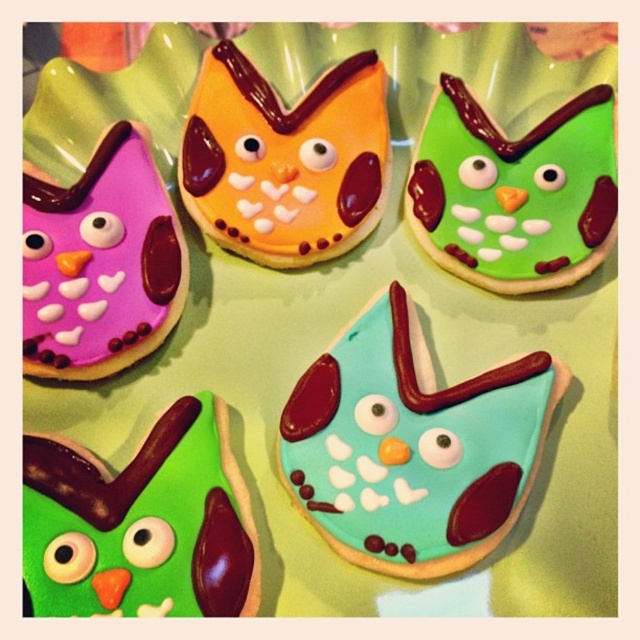
Which is more to the right, teal glossy cookie at center or green glossy cookie at upper right?

green glossy cookie at upper right

Who is more distant from viewer, [506,486] or [570,176]?

The point [570,176] is more distant.

Between point (420, 397) and point (483, 188), which one is positioned behind?

Point (483, 188)

At what (x,y) coordinates should I click in order to perform the action: click on teal glossy cookie at center. Please return your answer as a coordinate pair (x, y). The width and height of the screenshot is (640, 640). Looking at the image, I should click on (412, 445).

Measure the distance between point (230, 145) and camera.

Point (230, 145) is 1.23 meters from camera.

What do you see at coordinates (284, 160) in the screenshot? This screenshot has height=640, width=640. I see `matte chocolate cookie at center` at bounding box center [284, 160].

Is point (340, 243) positioned before point (93, 212)?

No, (340, 243) is behind (93, 212).

Where is `matte chocolate cookie at center`? The image size is (640, 640). matte chocolate cookie at center is located at coordinates (284, 160).

Who is shorter, teal glossy cookie at center or matte purple cookie at upper left?

Standing shorter between the two is matte purple cookie at upper left.

Between point (392, 380) and point (90, 172), which one is positioned in front?

Point (392, 380) is more forward.

At what (x,y) coordinates should I click in order to perform the action: click on teal glossy cookie at center. Please return your answer as a coordinate pair (x, y). The height and width of the screenshot is (640, 640). Looking at the image, I should click on (412, 445).

Locate an element on the screen. This screenshot has width=640, height=640. teal glossy cookie at center is located at coordinates (412, 445).